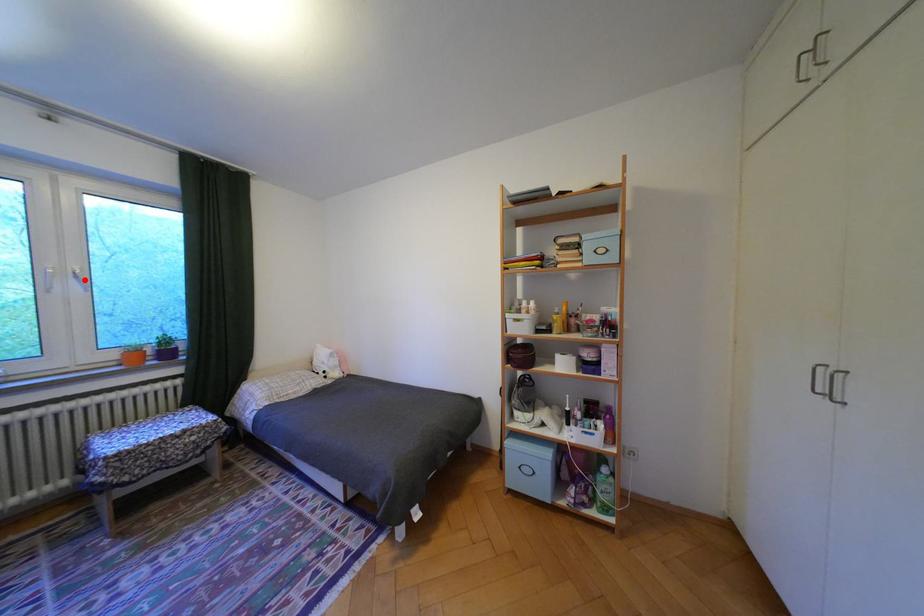
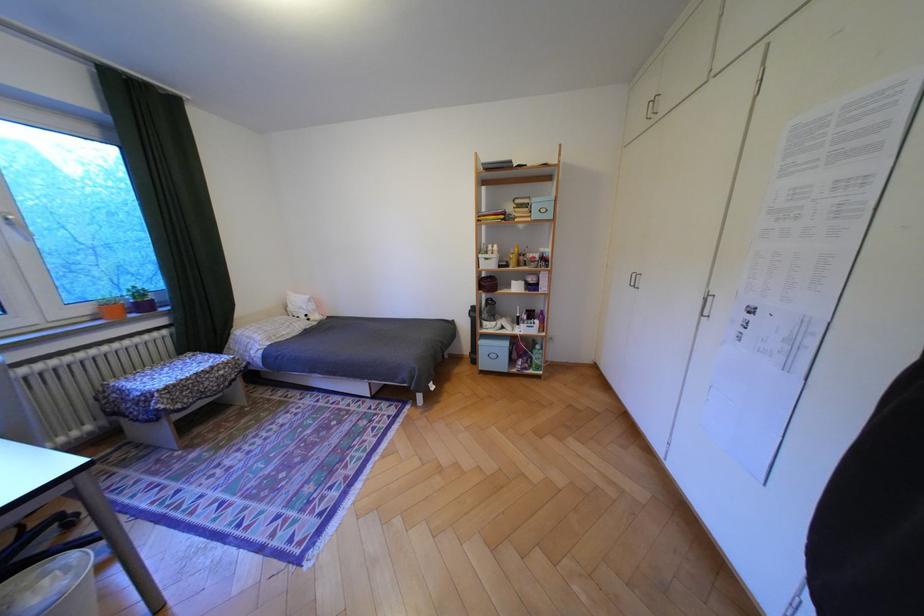
Question: I am providing you with two images of the same scene from different viewpoints. Image1 has a red point marked. In image2, the corresponding 3D location appears at what relative position? Reply with the corresponding letter.

Choices:
 (A) Closer
 (B) Farther

Answer: (B)